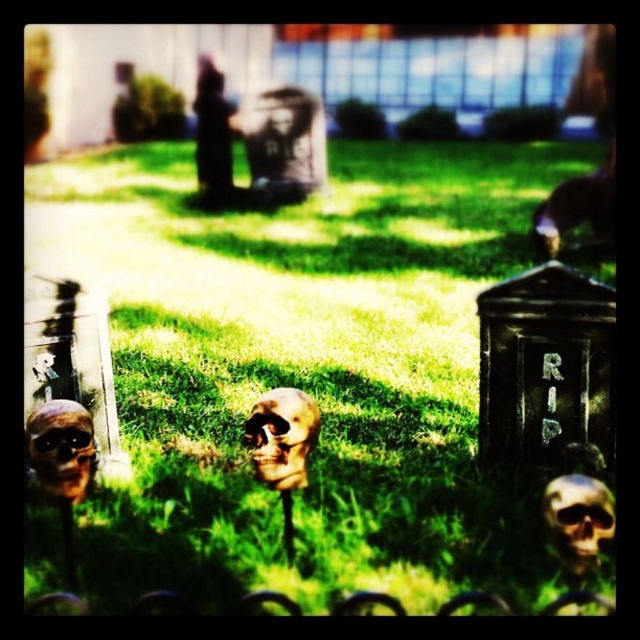
Looking at this image, is green grass at center shorter than brown matte skull at center?

No.

Can you confirm if green grass at center is taller than brown matte skull at center?

Yes.

Between point (292, 236) and point (272, 420), which one is positioned in front?

Point (272, 420)

At what (x,y) coordinates should I click in order to perform the action: click on green grass at center. Please return your answer as a coordinate pair (x, y). The width and height of the screenshot is (640, 640). Looking at the image, I should click on (296, 371).

Does green grass at center have a lesser width compared to gold metallic skull at center?

Incorrect, green grass at center's width is not less than gold metallic skull at center's.

Can you confirm if green grass at center is positioned above gold metallic skull at center?

Indeed, green grass at center is positioned over gold metallic skull at center.

This screenshot has height=640, width=640. What are the coordinates of `green grass at center` in the screenshot? It's located at (296, 371).

In the scene shown: Does brown matte skull at center have a greater width compared to gold metallic skull at center?

Yes, brown matte skull at center is wider than gold metallic skull at center.

Find the location of a particular element. brown matte skull at center is located at coordinates (282, 436).